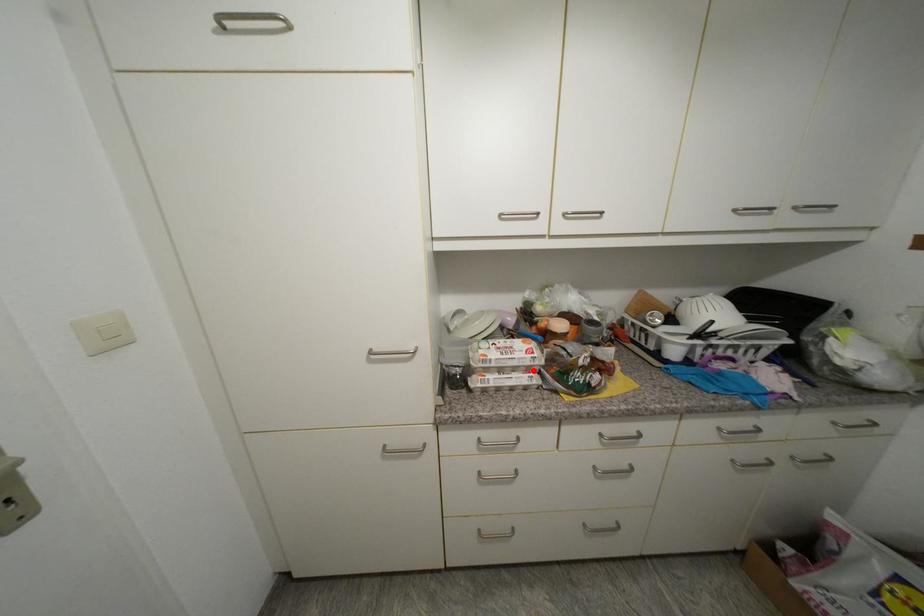
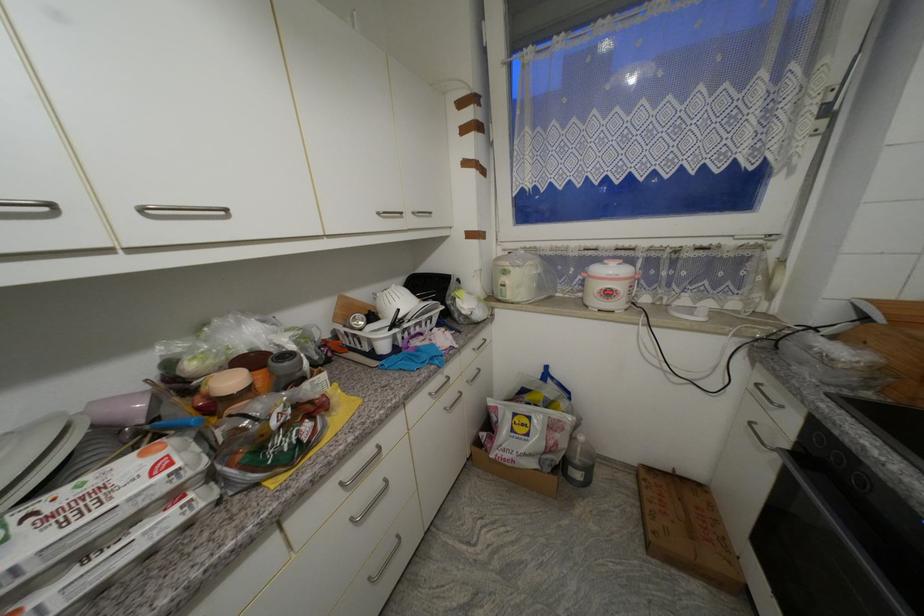
In the second image, find the point that corresponds to the highlighted location in the first image.

(178, 498)